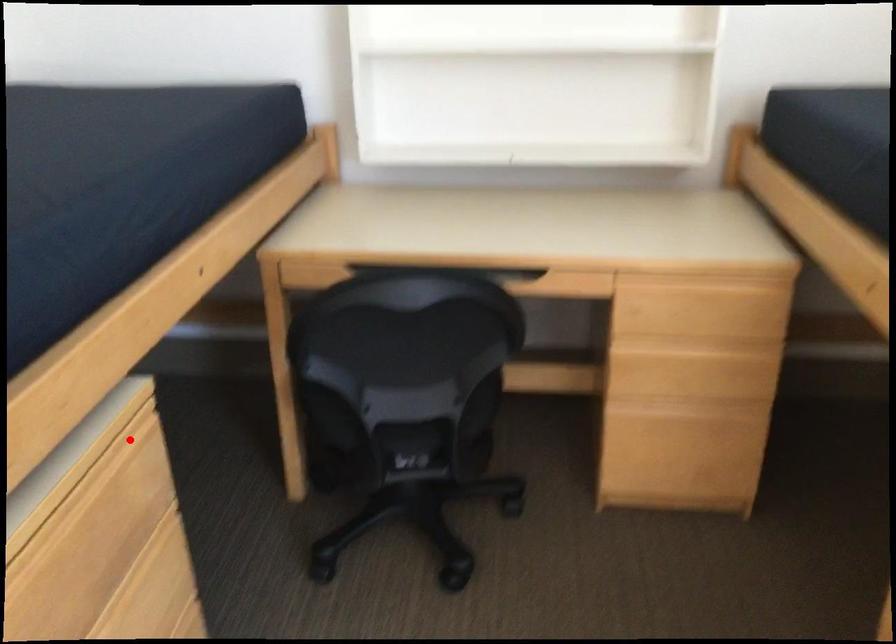
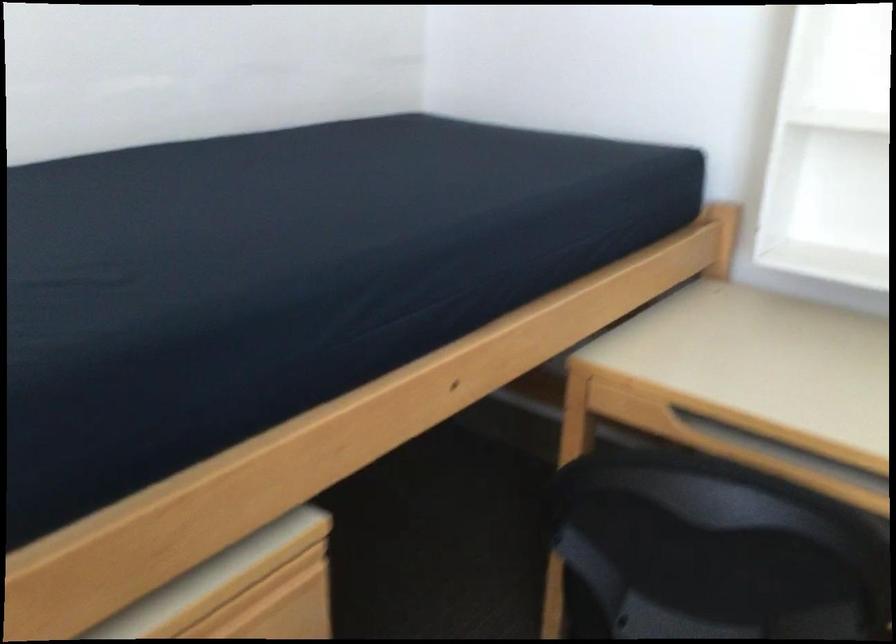
Question: I am providing you with two images of the same scene from different viewpoints. Image1 has a red point marked. In image2, the corresponding 3D location appears at what relative position? Reply with the corresponding letter.

Choices:
 (A) Closer
 (B) Farther

Answer: (A)